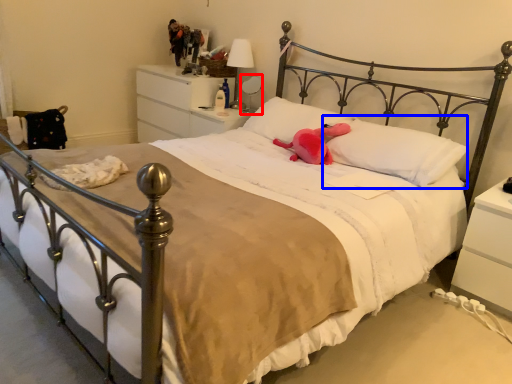
Question: Which object is further to the camera taking this photo, table lamp (highlighted by a red box) or pillow (highlighted by a blue box)?

Choices:
 (A) table lamp
 (B) pillow

Answer: (A)